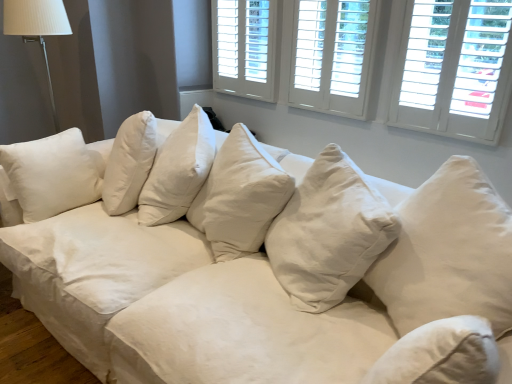
Question: Considering the relative sizes of white wood shutters at upper right, arranged as the 1th window when viewed from the right, and white fabric lampshade at upper left in the image provided, is white wood shutters at upper right, arranged as the 1th window when viewed from the right, shorter than white fabric lampshade at upper left?

Choices:
 (A) yes
 (B) no

Answer: (A)

Question: Is white wood shutters at upper right, arranged as the 1th window when viewed from the right, not within white fabric lampshade at upper left?

Choices:
 (A) yes
 (B) no

Answer: (A)

Question: Is the position of white wood shutters at upper right, arranged as the third window when viewed from the left, less distant than that of white fabric lampshade at upper left?

Choices:
 (A) no
 (B) yes

Answer: (B)

Question: Is white wood shutters at upper right, arranged as the 1th window when viewed from the right, not close to white fabric lampshade at upper left?

Choices:
 (A) no
 (B) yes

Answer: (B)

Question: Does white wood shutters at upper right, arranged as the third window when viewed from the left, turn towards white fabric lampshade at upper left?

Choices:
 (A) yes
 (B) no

Answer: (B)

Question: Is white fabric lampshade at upper left taller or shorter than white wood window at upper center, the 2th window positioned from the left?

Choices:
 (A) short
 (B) tall

Answer: (B)

Question: From the image's perspective, relative to white wood window at upper center, the 2th window positioned from the left, is white fabric lampshade at upper left above or below?

Choices:
 (A) above
 (B) below

Answer: (B)

Question: Considering the positions of point (52, 107) and point (339, 94), is point (52, 107) closer or farther from the camera than point (339, 94)?

Choices:
 (A) farther
 (B) closer

Answer: (A)

Question: Looking at their shapes, would you say white fabric lampshade at upper left is wider or thinner than white wood window at upper center, the second window from the right?

Choices:
 (A) thin
 (B) wide

Answer: (B)

Question: Is white wood shutters at upper right, arranged as the third window when viewed from the left, to the left or to the right of white fabric lampshade at upper left in the image?

Choices:
 (A) right
 (B) left

Answer: (A)

Question: From a real-world perspective, is white wood shutters at upper right, arranged as the third window when viewed from the left, physically located above or below white fabric lampshade at upper left?

Choices:
 (A) below
 (B) above

Answer: (B)

Question: Choose the correct answer: Is white wood shutters at upper right, arranged as the third window when viewed from the left, inside white fabric lampshade at upper left or outside it?

Choices:
 (A) outside
 (B) inside

Answer: (A)

Question: Considering their positions, is white wood shutters at upper right, arranged as the 1th window when viewed from the right, located in front of or behind white fabric lampshade at upper left?

Choices:
 (A) behind
 (B) front

Answer: (B)

Question: From the image's perspective, relative to white wood shutters at upper center, placed as the 1th window when sorted from left to right, is white cotton couch at center above or below?

Choices:
 (A) below
 (B) above

Answer: (A)

Question: Considering the relative positions of white cotton couch at center and white wood shutters at upper center, placed as the 1th window when sorted from left to right, in the image provided, is white cotton couch at center to the left or to the right of white wood shutters at upper center, placed as the 1th window when sorted from left to right,?

Choices:
 (A) right
 (B) left

Answer: (B)